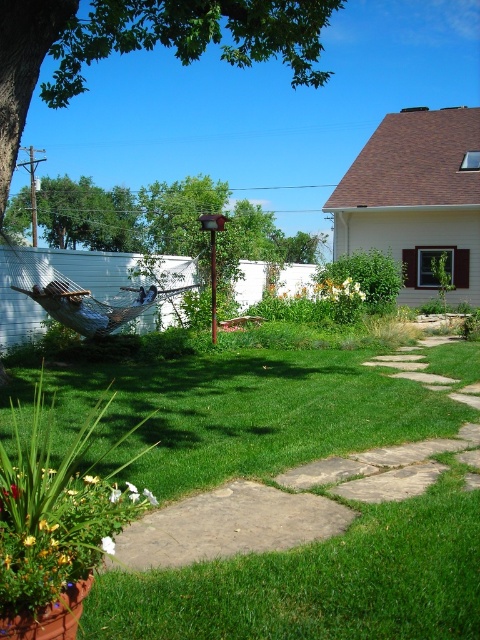
Between green leafy tree at upper left and blue fabric hammock at center, which one has more height?

With more height is green leafy tree at upper left.

The width and height of the screenshot is (480, 640). I want to click on green leafy tree at upper left, so click(x=142, y=45).

Locate an element on the screen. Image resolution: width=480 pixels, height=640 pixels. green leafy tree at upper left is located at coordinates (142, 45).